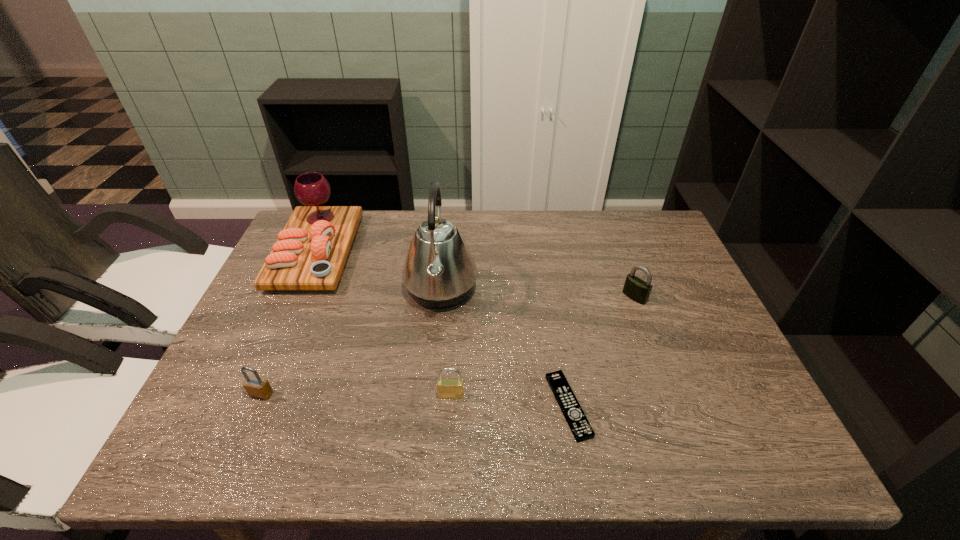
You are a GUI agent. You are given a task and a screenshot of the screen. Output one action in this format:
    pyautogui.click(x=<x>, y=<y>)
    Task: Click on the tallest object
    
    Given the screenshot: What is the action you would take?
    pyautogui.click(x=439, y=271)

The height and width of the screenshot is (540, 960). Find the location of `platter`. platter is located at coordinates (311, 251).

Find the location of a particular element. The image size is (960, 540). the farthest padlock is located at coordinates (636, 289).

Find the location of a particular element. This screenshot has height=540, width=960. the rightmost padlock is located at coordinates (636, 289).

Identify the location of the second padlock from left to right. This screenshot has height=540, width=960. (447, 388).

This screenshot has height=540, width=960. Identify the location of the leftmost padlock. (256, 386).

The height and width of the screenshot is (540, 960). I want to click on the shortest object, so click(579, 425).

Find the location of a particular element. the second object from right to left is located at coordinates coord(579,425).

Where is `free space located from the spout of the kettle`? The width and height of the screenshot is (960, 540). free space located from the spout of the kettle is located at coordinates (568, 289).

Image resolution: width=960 pixels, height=540 pixels. Find the location of `free space located 0.240m on the right of the second tallest object`. free space located 0.240m on the right of the second tallest object is located at coordinates (432, 252).